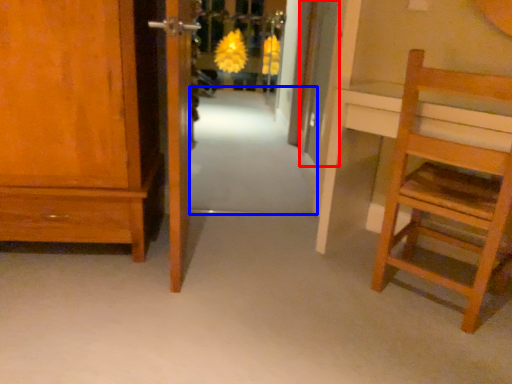
Question: Among these objects, which one is nearest to the camera, door (highlighted by a red box) or path (highlighted by a blue box)?

Choices:
 (A) door
 (B) path

Answer: (B)